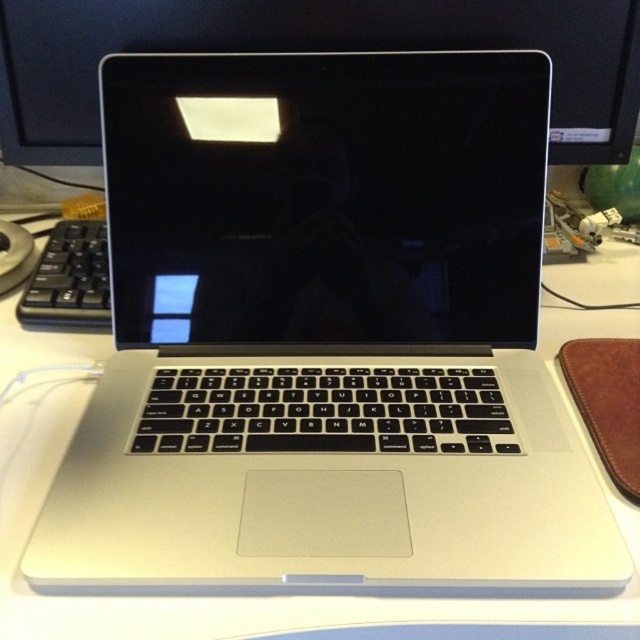
Is satin black monitor at center to the right of black matte keyboard at left from the viewer's perspective?

Indeed, satin black monitor at center is positioned on the right side of black matte keyboard at left.

Is satin black monitor at center further to the viewer compared to black matte keyboard at left?

No, it is not.

Is point (518, 17) less distant than point (72, 321)?

Yes.

Find the location of a particular element. satin black monitor at center is located at coordinates (310, 51).